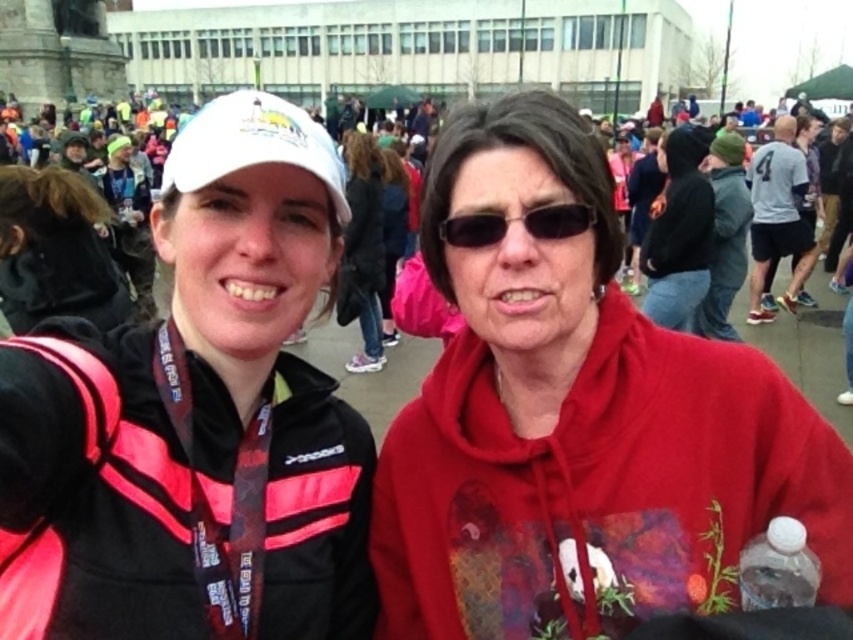
In the scene shown: Can you confirm if matte red hoodie at center is positioned above dark brown hair at center?

No.

Can you confirm if matte red hoodie at center is taller than dark brown hair at center?

Yes, matte red hoodie at center is taller than dark brown hair at center.

Is point (685, 579) positioned after point (370, 241)?

No, (685, 579) is in front of (370, 241).

Find the location of a particular element. matte red hoodie at center is located at coordinates coord(578,420).

Does matte red hoodie at center appear on the left side of black plastic sunglasses at center?

No, matte red hoodie at center is not to the left of black plastic sunglasses at center.

Between point (598, 472) and point (561, 212), which one is positioned behind?

Point (561, 212)

This screenshot has height=640, width=853. In order to click on matte red hoodie at center in this screenshot , I will do `click(578, 420)`.

Is point (361, 212) more distant than point (532, 220)?

Yes, it is behind point (532, 220).

Locate an element on the screen. The height and width of the screenshot is (640, 853). dark brown hair at center is located at coordinates (363, 250).

Identify the location of dark brown hair at center. (363, 250).